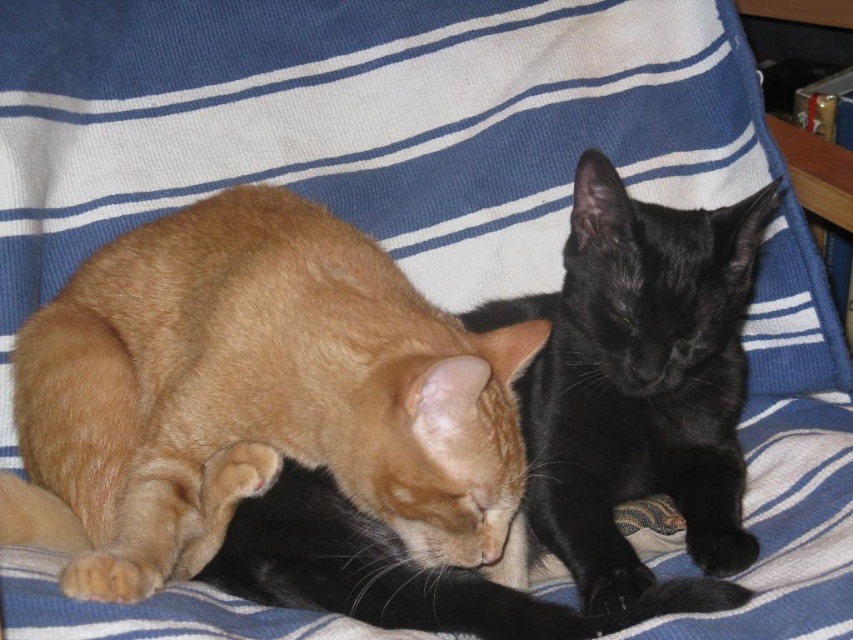
You are a cat owner who wants to place a small blanket over both cats resting on the striped fabric. Given that the orange fur cat at center is larger than the black silky cat at center, which cat requires a larger portion of the blanket?

The orange fur cat at center requires a larger portion of the blanket because it is bigger than the black silky cat at center.

You are a photographer trying to capture a closeup of the black silky cat at center without including the orange fur cat at center in the frame. Given their positions, is this possible?

The orange fur cat at center is to the left of the black silky cat at center, so if you position your camera to the right side of the black silky cat at center and frame the shot tightly, you can exclude the orange fur cat at center from the image.

You are a photographer trying to capture a clear photo of the black silky cat at center. However, the orange fur cat at center is blocking the view. Can you adjust your position to take the photo without moving either cat?

The orange fur cat at center is in front of the black silky cat at center, so you can move your position slightly to the side where the orange fur cat at center is not blocking the view of the black silky cat at center.